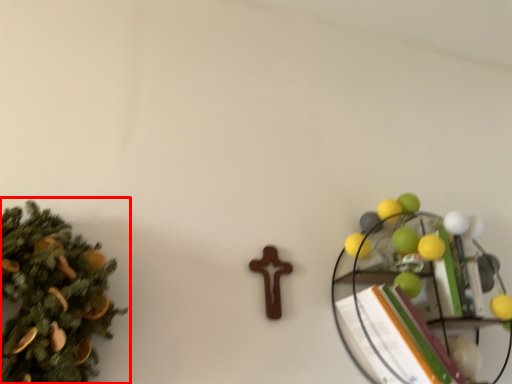
Question: In this image, where is christmas tree (annotated by the red box) located relative to shelf?

Choices:
 (A) right
 (B) left

Answer: (B)